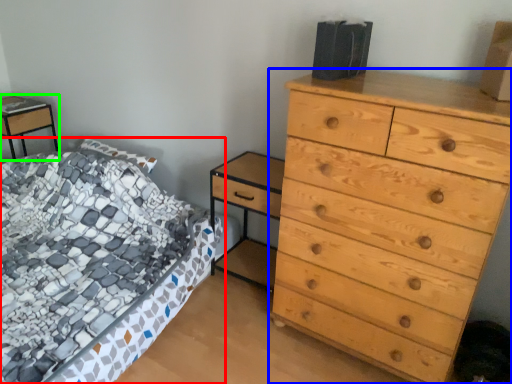
Question: Based on their relative distances, which object is nearer to bed (highlighted by a red box)? Choose from chest of drawers (highlighted by a blue box) and nightstand (highlighted by a green box).

Choices:
 (A) chest of drawers
 (B) nightstand

Answer: (A)